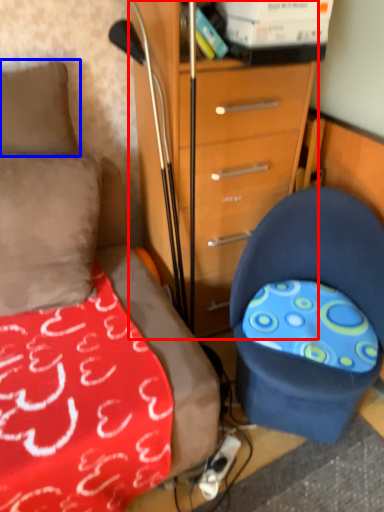
Question: Which object is further to the camera taking this photo, chest of drawers (highlighted by a red box) or pillow (highlighted by a blue box)?

Choices:
 (A) chest of drawers
 (B) pillow

Answer: (B)